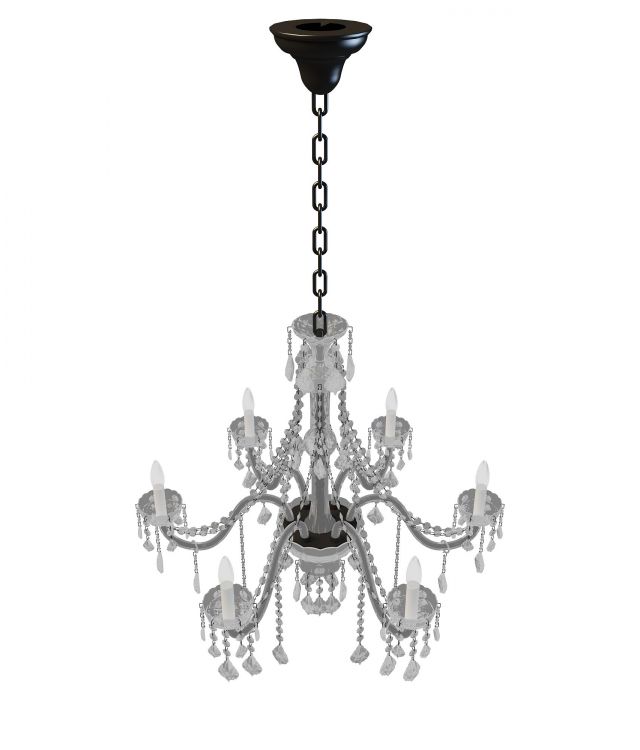
At what (x,y) coordinates should I click in order to perform the action: click on light. Please return your answer as a coordinate pair (x, y). The image size is (640, 750). Looking at the image, I should click on (156, 471), (227, 574), (412, 574), (484, 468), (388, 396), (246, 399).